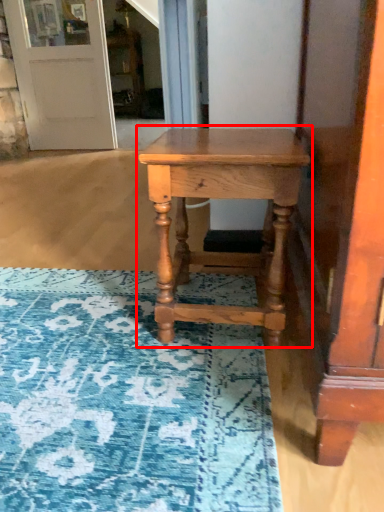
Question: Observing the image, what is the correct spatial positioning of table (annotated by the red box) in reference to door?

Choices:
 (A) right
 (B) left

Answer: (A)